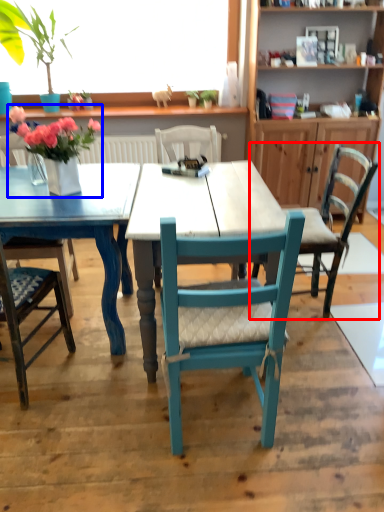
Question: Which object appears closest to the camera in this image, chair (highlighted by a red box) or floral arrangement (highlighted by a blue box)?

Choices:
 (A) chair
 (B) floral arrangement

Answer: (B)